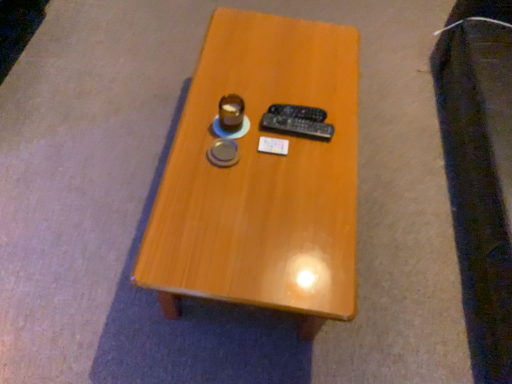
Identify the location of vacant region in front of black plastic remote control at center, arranged as the first remote control when viewed from the front. The height and width of the screenshot is (384, 512). (290, 174).